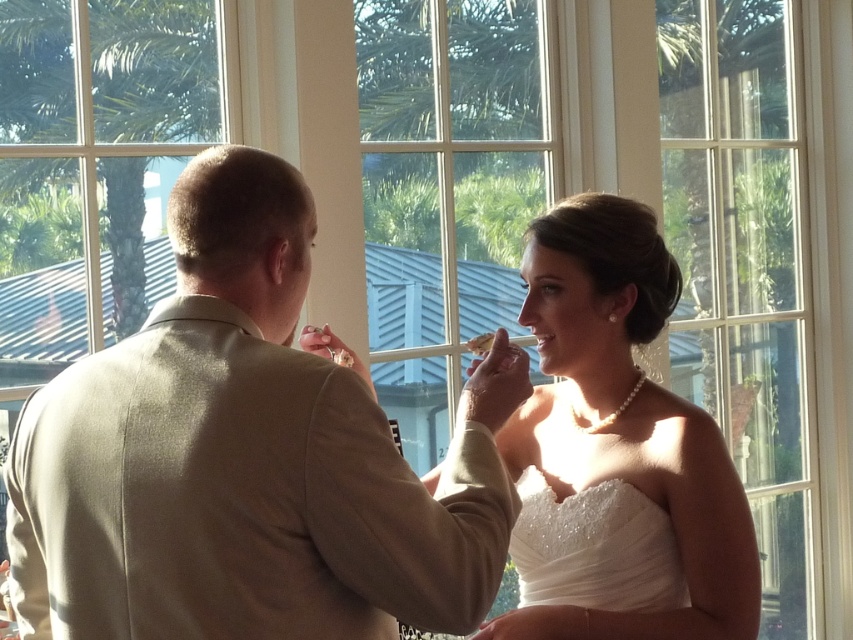
Between point (268, 614) and point (637, 605), which one is positioned in front?

Point (268, 614) is in front.

In the scene shown: Does tan fabric suit at center have a lesser height compared to white beaded fabric at center?

In fact, tan fabric suit at center may be taller than white beaded fabric at center.

The height and width of the screenshot is (640, 853). Identify the location of tan fabric suit at center. (247, 458).

Can you confirm if tan fabric suit at center is positioned to the right of pearl necklace at upper center?

In fact, tan fabric suit at center is to the left of pearl necklace at upper center.

Does tan fabric suit at center have a lesser height compared to pearl necklace at upper center?

Correct, tan fabric suit at center is not as tall as pearl necklace at upper center.

The height and width of the screenshot is (640, 853). What do you see at coordinates (247, 458) in the screenshot?
I see `tan fabric suit at center` at bounding box center [247, 458].

The height and width of the screenshot is (640, 853). I want to click on tan fabric suit at center, so click(x=247, y=458).

Consider the image. Is pearl necklace at upper center shorter than white beaded fabric at center?

No.

Image resolution: width=853 pixels, height=640 pixels. Describe the element at coordinates (624, 435) in the screenshot. I see `pearl necklace at upper center` at that location.

This screenshot has width=853, height=640. Identify the location of pearl necklace at upper center. (624, 435).